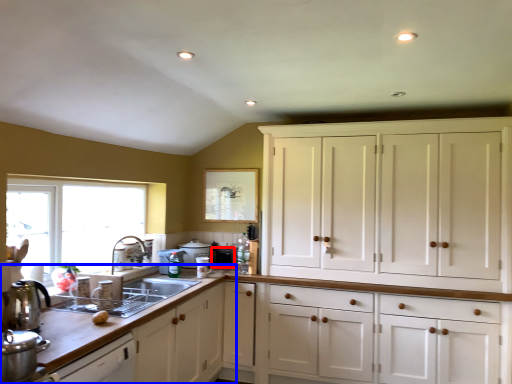
Question: Which object is further to the camera taking this photo, appliance (highlighted by a red box) or countertop (highlighted by a blue box)?

Choices:
 (A) appliance
 (B) countertop

Answer: (A)